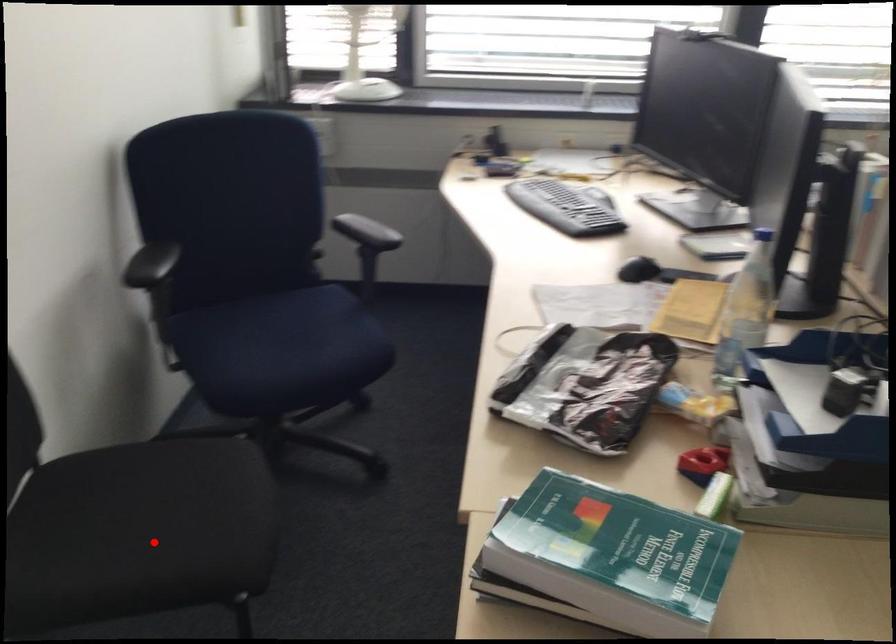
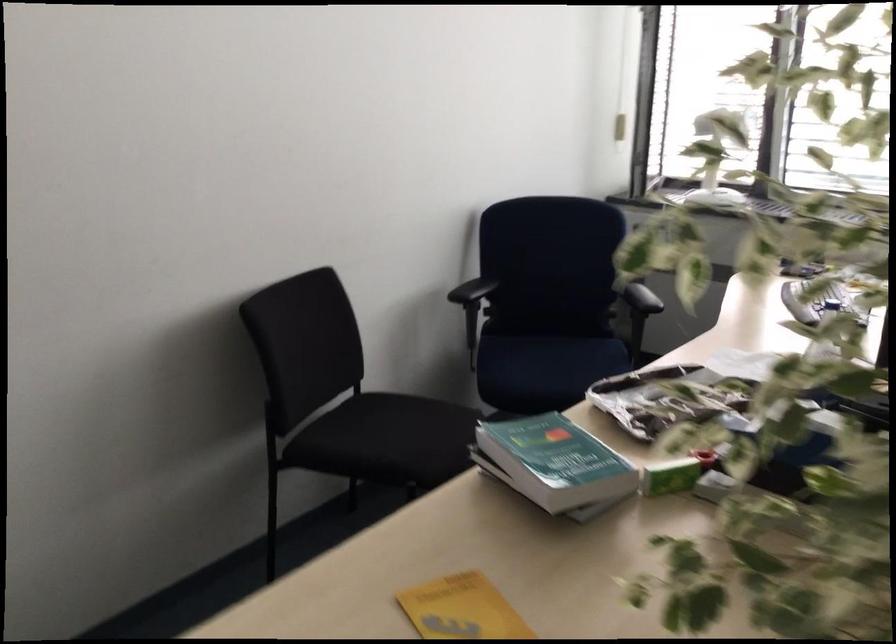
In the second image, find the point that corresponds to the highlighted location in the first image.

(377, 436)